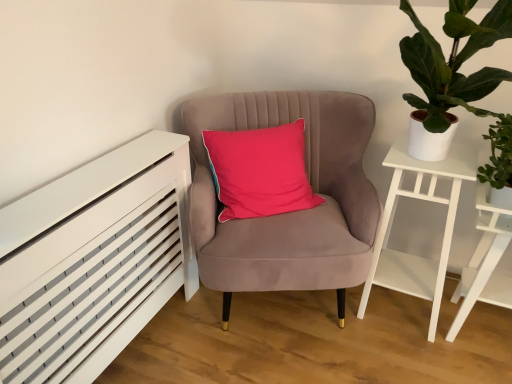
Question: From a real-world perspective, is velvet pink chair at center located beneath green leafy plant at right?

Choices:
 (A) no
 (B) yes

Answer: (B)

Question: From a real-world perspective, does velvet pink chair at center stand above green leafy plant at right?

Choices:
 (A) yes
 (B) no

Answer: (B)

Question: Is velvet pink chair at center turned away from green leafy plant at right?

Choices:
 (A) yes
 (B) no

Answer: (B)

Question: Can you confirm if velvet pink chair at center is wider than green leafy plant at right?

Choices:
 (A) yes
 (B) no

Answer: (A)

Question: Can you confirm if velvet pink chair at center is positioned to the right of green leafy plant at right?

Choices:
 (A) no
 (B) yes

Answer: (A)

Question: Would you consider velvet pink chair at center to be distant from green leafy plant at right?

Choices:
 (A) yes
 (B) no

Answer: (B)

Question: From the image's perspective, is velvet pink chair at center below white wooden side table at right?

Choices:
 (A) no
 (B) yes

Answer: (A)

Question: Is velvet pink chair at center to the right of white wooden side table at right from the viewer's perspective?

Choices:
 (A) yes
 (B) no

Answer: (B)

Question: Is velvet pink chair at center wider than white wooden side table at right?

Choices:
 (A) yes
 (B) no

Answer: (A)

Question: Is velvet pink chair at center oriented away from white wooden side table at right?

Choices:
 (A) no
 (B) yes

Answer: (A)

Question: Considering the relative sizes of velvet pink chair at center and white wooden side table at right in the image provided, is velvet pink chair at center taller than white wooden side table at right?

Choices:
 (A) yes
 (B) no

Answer: (A)

Question: Is there a large distance between velvet pink chair at center and white wooden side table at right?

Choices:
 (A) yes
 (B) no

Answer: (B)

Question: Is white wooden side table at right touching white matte side table at right?

Choices:
 (A) no
 (B) yes

Answer: (A)